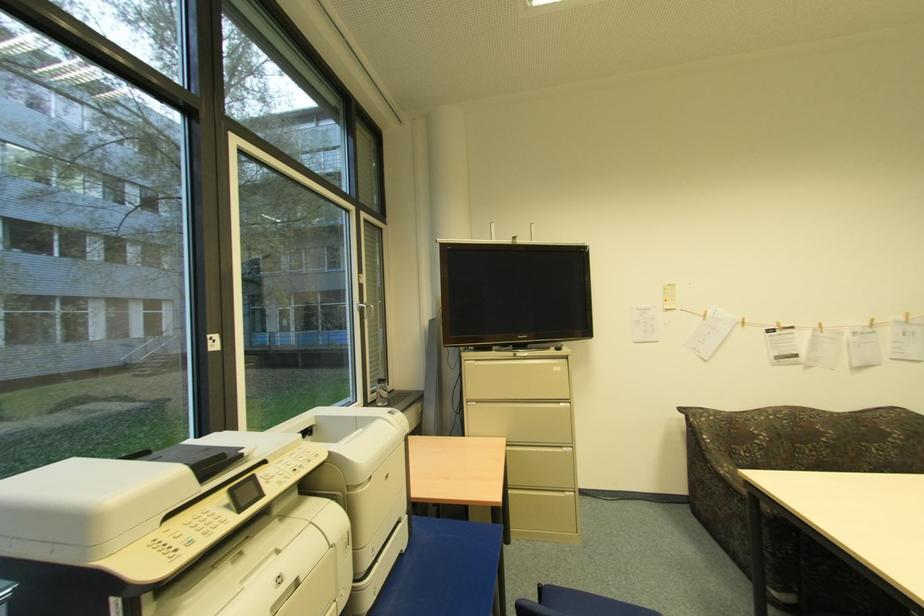
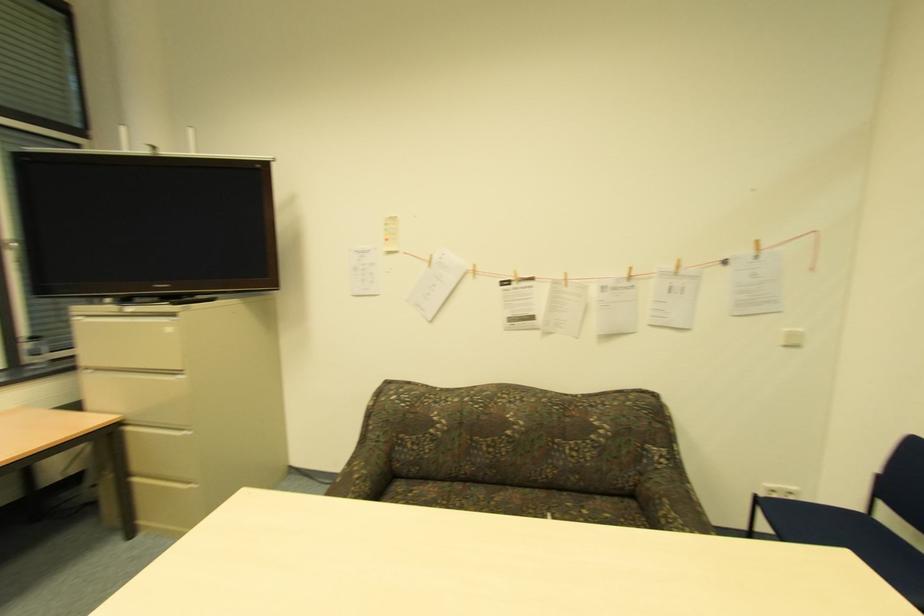
Locate, in the second image, the point that corresponds to point (564, 447) in the first image.

(187, 429)